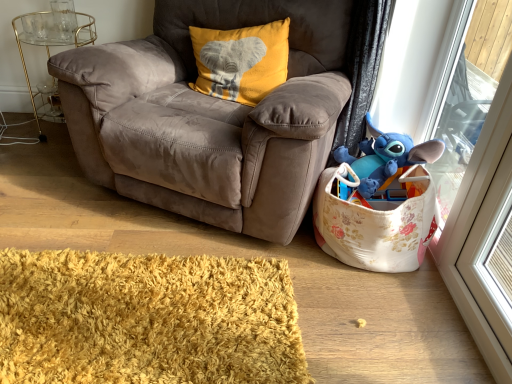
Question: From a real-world perspective, is suede brown armchair at center above or below gold metallic side table at left?

Choices:
 (A) below
 (B) above

Answer: (B)

Question: Is suede brown armchair at center in front of or behind gold metallic side table at left in the image?

Choices:
 (A) front
 (B) behind

Answer: (A)

Question: Which of these objects is positioned closest to the suede brown armchair at center?

Choices:
 (A) blue plush toy at upper right
 (B) yellow shaggy rug at lower left
 (C) floral fabric toy storage at lower right
 (D) gold metallic side table at left
 (E) blue plush toy at right

Answer: (C)

Question: Based on their relative distances, which object is nearer to the yellow shaggy rug at lower left?

Choices:
 (A) suede brown armchair at center
 (B) floral fabric toy storage at lower right
 (C) gold metallic side table at left
 (D) yellow velvet pillow at upper center
 (E) blue plush toy at right

Answer: (B)